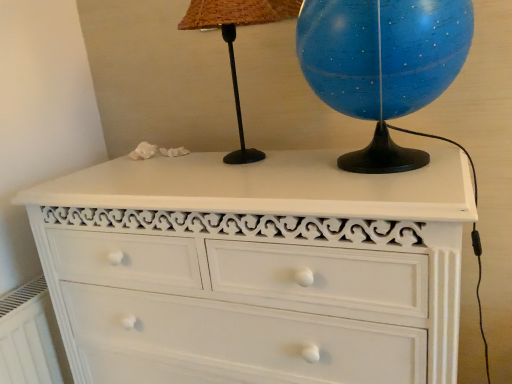
Where is `vacant space underneath blue glossy globe at upper right (from a real-world perspective)`? vacant space underneath blue glossy globe at upper right (from a real-world perspective) is located at coordinates (402, 162).